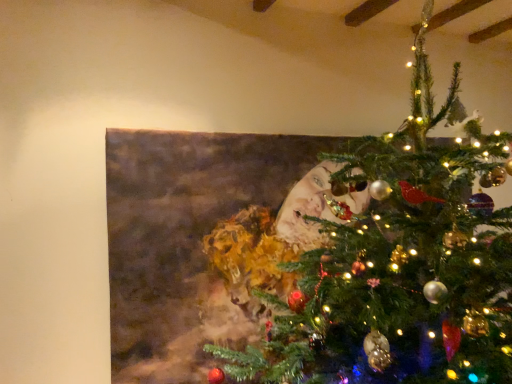
Question: Should I look upward or downward to see green textured christmas tree at center?

Choices:
 (A) up
 (B) down

Answer: (B)